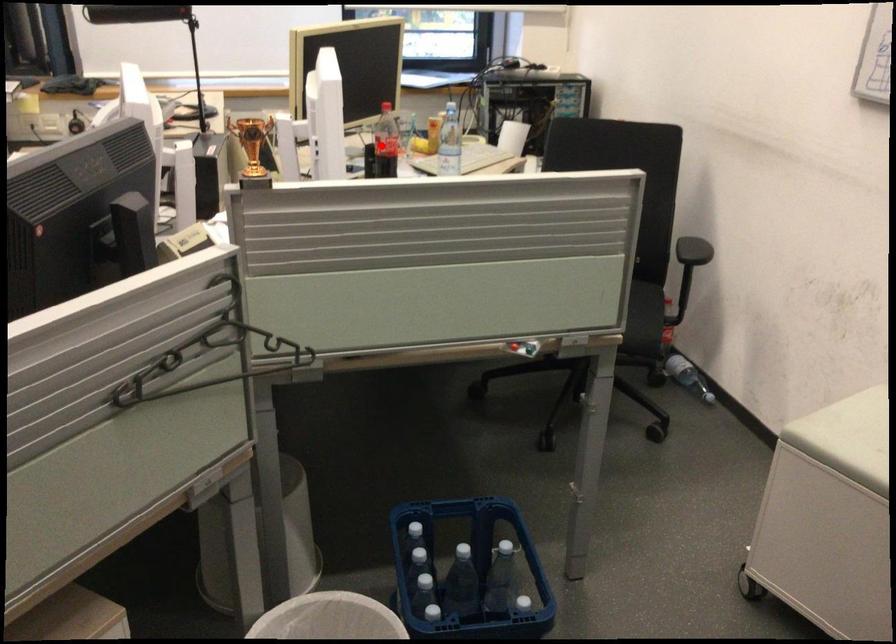
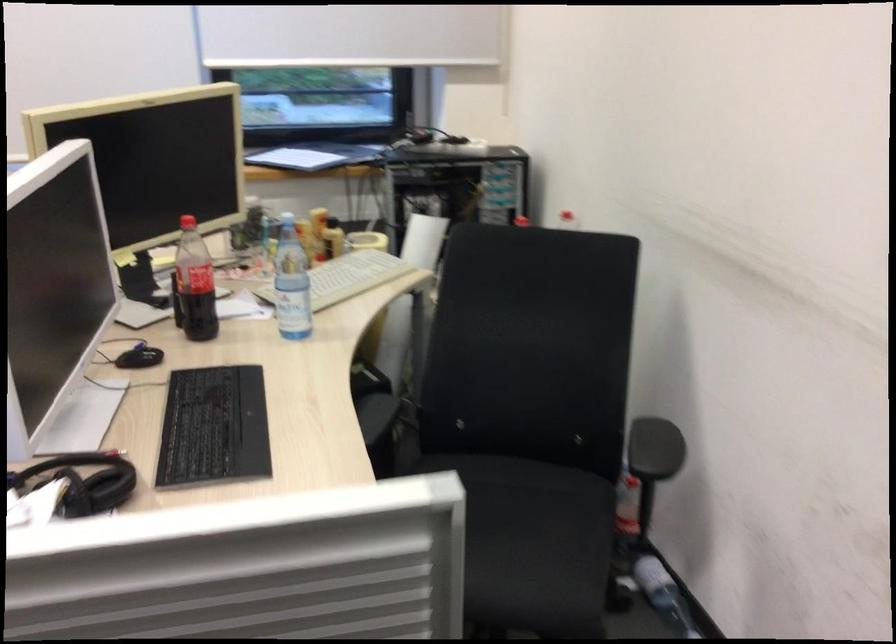
Locate, in the second image, the point that corresponds to the highlighted location in the first image.

(194, 283)